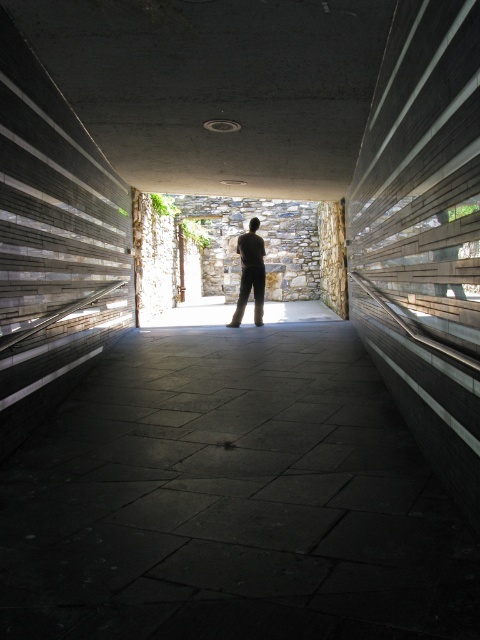
Where is `stone wall at center`? The image size is (480, 640). stone wall at center is located at coordinates (235, 250).

Does stone wall at center lie behind dark brown pants at center?

That is True.

Is point (238, 196) positioned after point (255, 260)?

Yes, it is.

The image size is (480, 640). I want to click on stone wall at center, so click(x=235, y=250).

Does dark stone pavement at center have a larger size compared to dark brown pants at center?

Yes, dark stone pavement at center is bigger than dark brown pants at center.

Can you confirm if dark stone pavement at center is smaller than dark brown pants at center?

Incorrect, dark stone pavement at center is not smaller in size than dark brown pants at center.

The width and height of the screenshot is (480, 640). What are the coordinates of `dark stone pavement at center` in the screenshot? It's located at point(231,499).

Can you confirm if dark stone pavement at center is positioned to the right of stone wall at center?

No, dark stone pavement at center is not to the right of stone wall at center.

Between point (168, 609) and point (273, 264), which one is positioned in front?

Point (168, 609)

Image resolution: width=480 pixels, height=640 pixels. Identify the location of dark stone pavement at center. (231, 499).